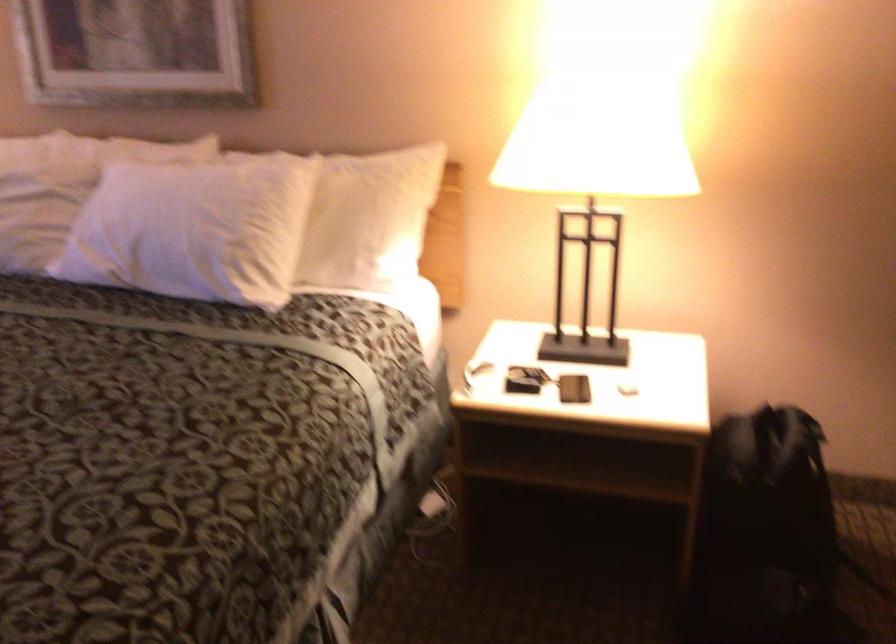
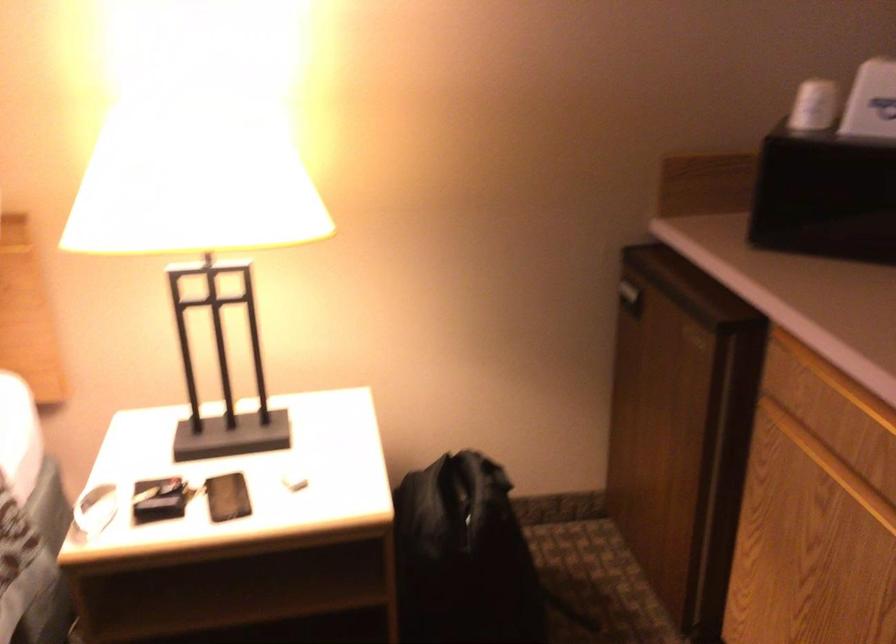
Question: The images are taken continuously from a first-person perspective. In which direction are you moving?

Choices:
 (A) Left
 (B) Right
 (C) Forward
 (D) Backward

Answer: (C)